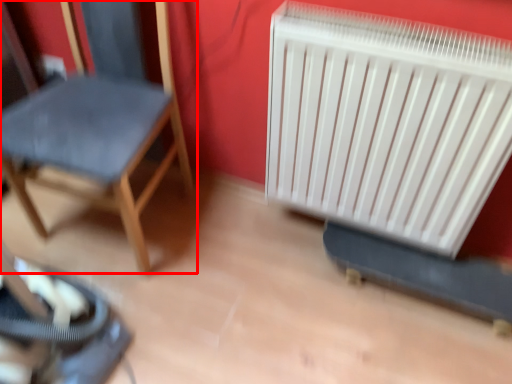
Question: From the image's perspective, considering the relative positions of chair (annotated by the red box) and radiator in the image provided, where is chair (annotated by the red box) located with respect to the staircase?

Choices:
 (A) below
 (B) above

Answer: (B)